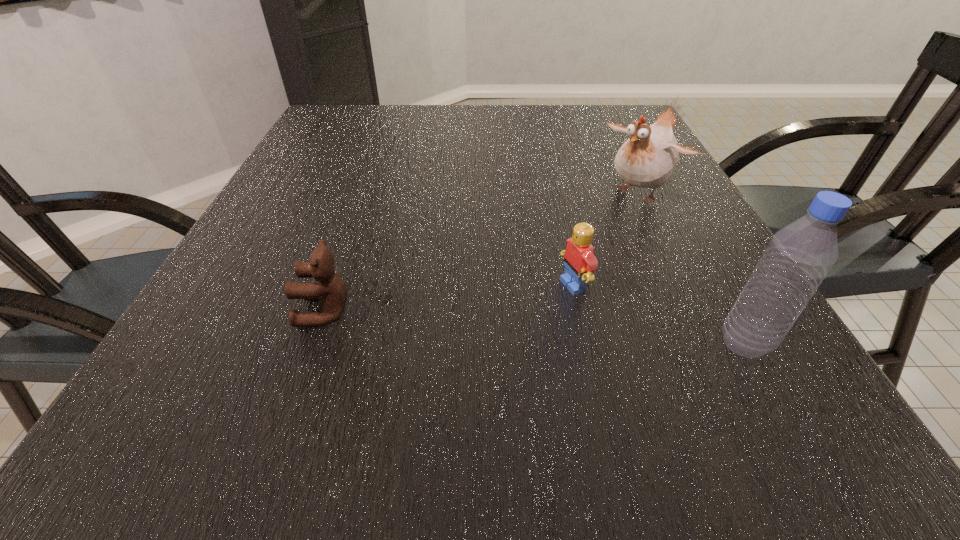
The width and height of the screenshot is (960, 540). In order to click on free spot between the bottle and the bird in this screenshot , I will do `click(692, 267)`.

Locate an element on the screen. This screenshot has height=540, width=960. vacant space that's between the Lego and the teddy bear is located at coordinates tap(449, 298).

Identify the location of empty space that is in between the third shortest object and the Lego. The width and height of the screenshot is (960, 540). (607, 239).

Find the location of a particular element. The image size is (960, 540). free space between the tallest object and the third object from right to left is located at coordinates (660, 314).

In order to click on unoccupied position between the second tallest object and the tallest object in this screenshot , I will do `click(692, 267)`.

The height and width of the screenshot is (540, 960). Find the location of `unoccupied area between the leftmost object and the farthest object`. unoccupied area between the leftmost object and the farthest object is located at coordinates (482, 252).

Identify the location of free space between the tallest object and the leftmost object. This screenshot has height=540, width=960. (535, 327).

Identify the location of object identified as the closest to the bottle. (579, 261).

In order to click on object that is the second closest to the Lego in this screenshot , I will do `click(648, 158)`.